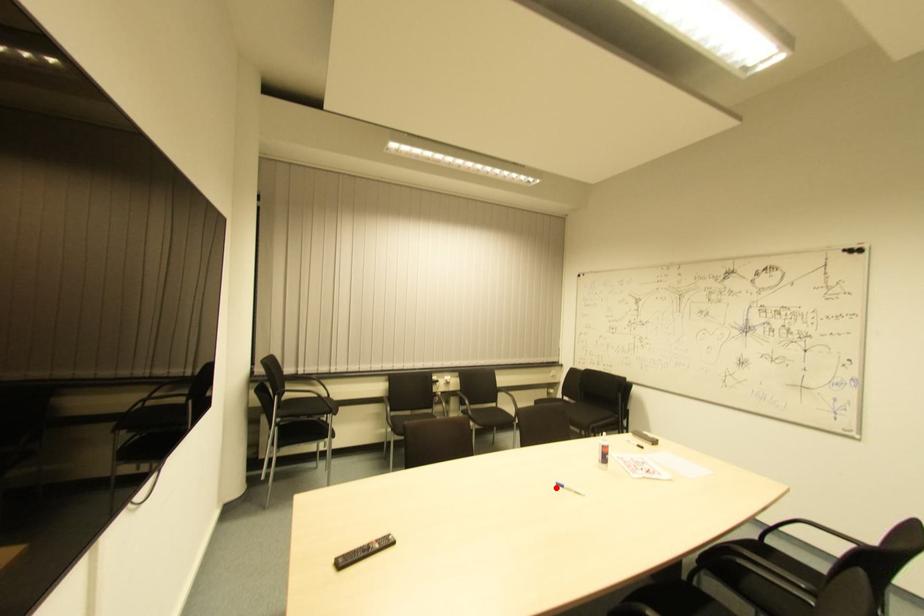
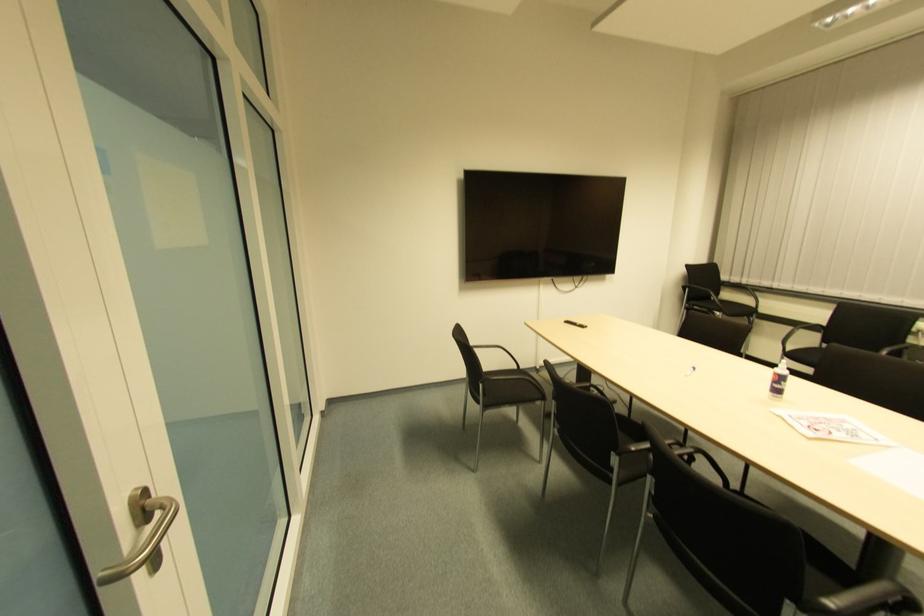
Where in the second image is the point corresponding to the highlighted location from the first image?

(691, 371)